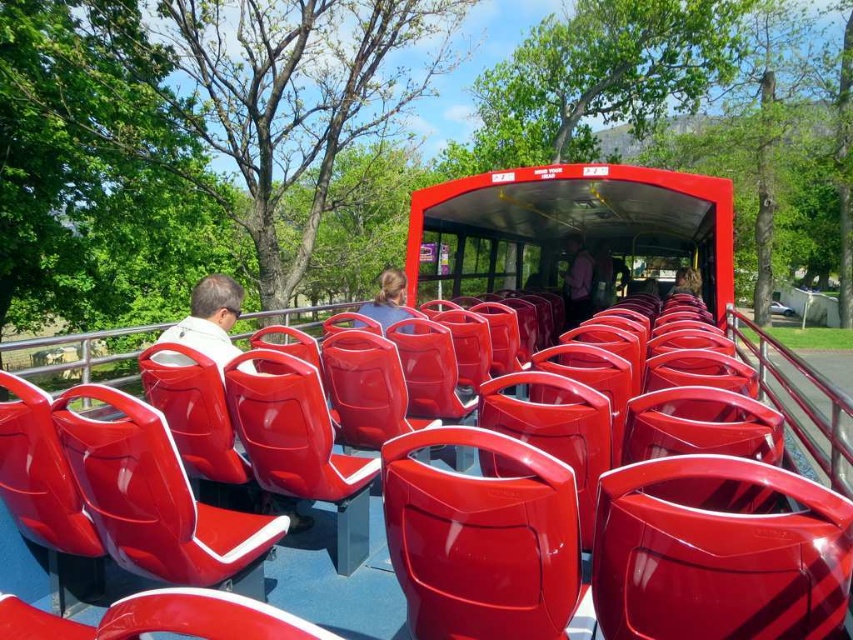
Question: Can you confirm if matte white shirt at left is bigger than matte blue shirt at center?

Choices:
 (A) yes
 (B) no

Answer: (B)

Question: Is matte white shirt at left above matte blue shirt at center?

Choices:
 (A) no
 (B) yes

Answer: (A)

Question: Which of these objects is positioned closest to the pink fabric shirt at center?

Choices:
 (A) matte blue shirt at center
 (B) matte white shirt at left

Answer: (A)

Question: Estimate the real-world distances between objects in this image. Which object is closer to the pink fabric shirt at center?

Choices:
 (A) matte blue shirt at center
 (B) matte white shirt at left

Answer: (A)

Question: Observing the image, what is the correct spatial positioning of matte white shirt at left in reference to pink fabric shirt at center?

Choices:
 (A) left
 (B) right

Answer: (A)

Question: Which object appears farthest from the camera in this image?

Choices:
 (A) matte blue shirt at center
 (B) pink fabric shirt at center

Answer: (B)